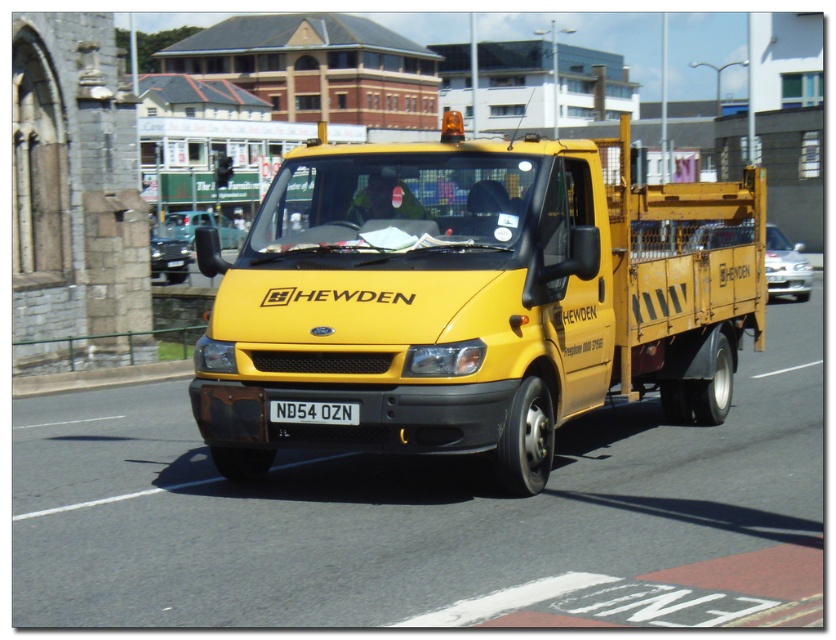
Between yellow matte truck at center and white plastic license plate at center, which one is positioned lower?

Positioned lower is white plastic license plate at center.

Consider the image. Does yellow matte truck at center appear on the left side of white plastic license plate at center?

In fact, yellow matte truck at center is to the right of white plastic license plate at center.

Between point (228, 388) and point (296, 419), which one is positioned in front?

Point (296, 419)

What are the coordinates of `yellow matte truck at center` in the screenshot? It's located at (473, 300).